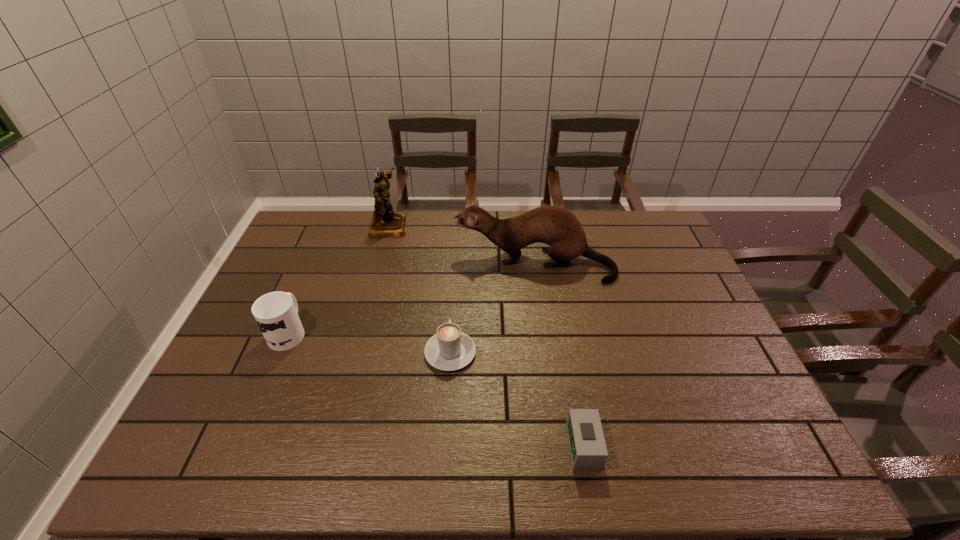
You are a GUI agent. You are given a task and a screenshot of the screen. Output one action in this format:
    pyautogui.click(x=<x>, y=<y>)
    Task: Click on the fourth object from right to left
    This screenshot has width=960, height=540.
    Given the screenshot: What is the action you would take?
    pyautogui.click(x=385, y=222)

Find the location of a particular element. The width and height of the screenshot is (960, 540). the tallest object is located at coordinates (385, 222).

Find the location of a particular element. The height and width of the screenshot is (540, 960). ferret is located at coordinates (559, 228).

At what (x,y) coordinates should I click in order to perform the action: click on the fourth nearest object. Please return your answer as a coordinate pair (x, y). Looking at the image, I should click on (559, 228).

At what (x,y) coordinates should I click in order to perform the action: click on mug. Please return your answer as a coordinate pair (x, y). The height and width of the screenshot is (540, 960). Looking at the image, I should click on (276, 313).

What are the coordinates of `the leftmost object` in the screenshot? It's located at (276, 313).

I want to click on cappuccino, so click(450, 349).

At what (x,y) coordinates should I click in order to perform the action: click on the shortest object. Please return your answer as a coordinate pair (x, y). The image size is (960, 540). Looking at the image, I should click on (588, 450).

Locate an element on the screen. the nearest object is located at coordinates (588, 450).

In order to click on free point located 0.110m on the front-facing side of the fourth object from right to left in this screenshot , I will do `click(437, 226)`.